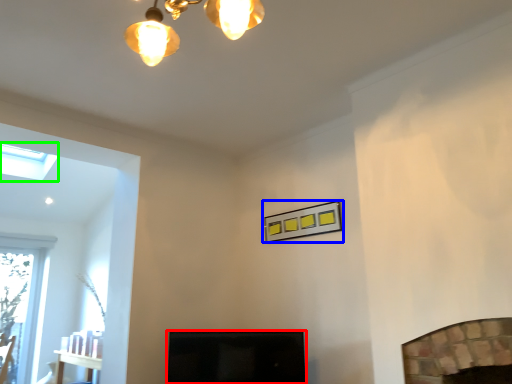
Question: Which is farther away from screen door (highlighted by a red box)? picture frame (highlighted by a blue box) or lamp (highlighted by a green box)?

Choices:
 (A) picture frame
 (B) lamp

Answer: (B)